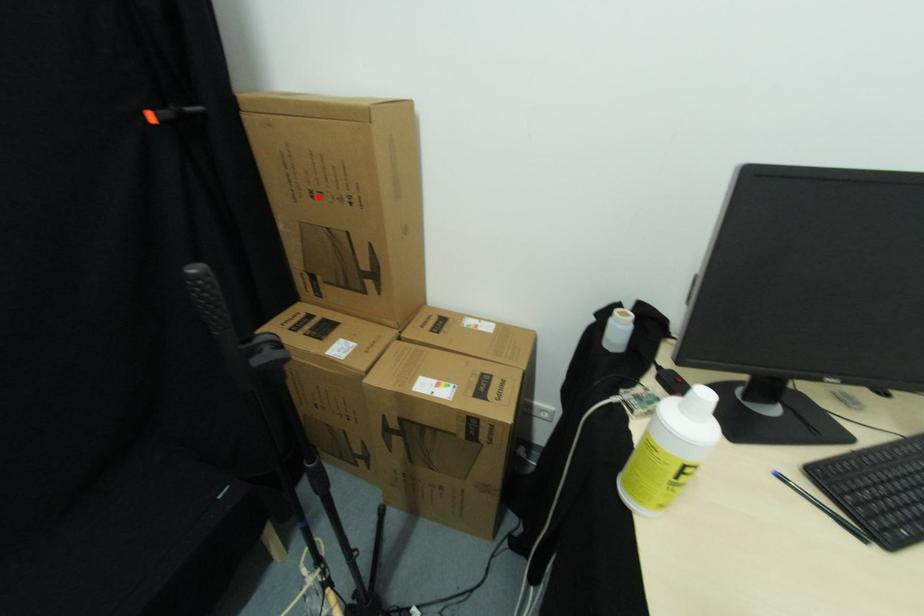
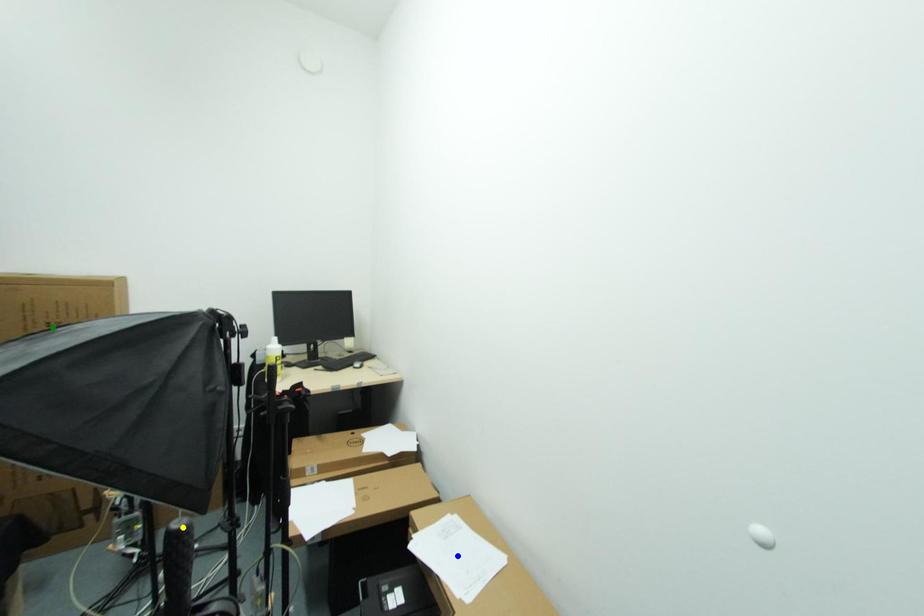
Question: I am providing you with two images of the same scene from different viewpoints. A red point is marked on the first image. You are given multiple points on the second image. Can you choose the point in image 2 that corresponds to the point in image 1?

Choices:
 (A) blue point
 (B) yellow point
 (C) green point

Answer: (C)